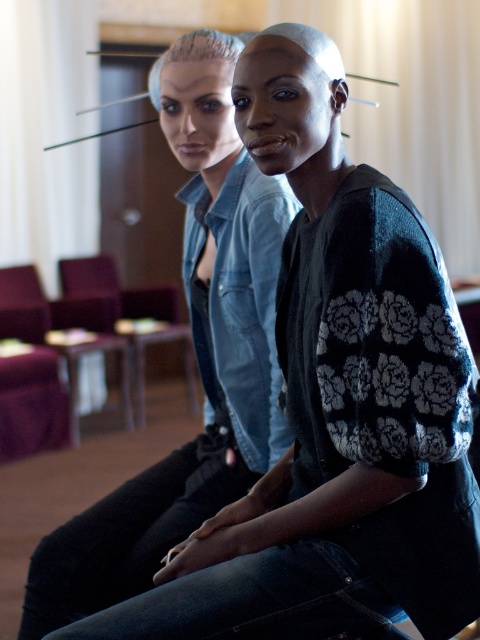
You are a photographer setting up a shoot in this room. You want to place a 1.2m tall mannequin between the denim jacket at center and the purple fabric armchair at center. Is the space between them sufficient for the mannequin?

The denim jacket at center is much taller than the purple fabric armchair at center. However, the height of the objects does not affect the vertical space between them. The question about placing a mannequin between them requires knowing the horizontal distance, which is not provided in the object descriptions. Therefore, it is impossible to determine if the space is sufficient based on the given information.

You are a tailor who needs to store the denim jacket at center and the purple fabric armchair at center in a storage room. The storage room has a narrow shelf that can only accommodate items with a thickness of 15 cm or less. Based on the image, can both items be placed on the shelf?

The denim jacket at center is thinner than the purple fabric armchair at center. Since the shelf can only hold items up to 15 cm thick, only the denim jacket at center can be placed on the shelf. The purple fabric armchair at center may be too thick to fit.

You are standing in the center of the room and want to sit down on the purple fabric armchair at center. Which direction should you move to reach it?

The purple fabric armchair at center is located at point (122, 316), so you should move towards the center of the room to reach it.